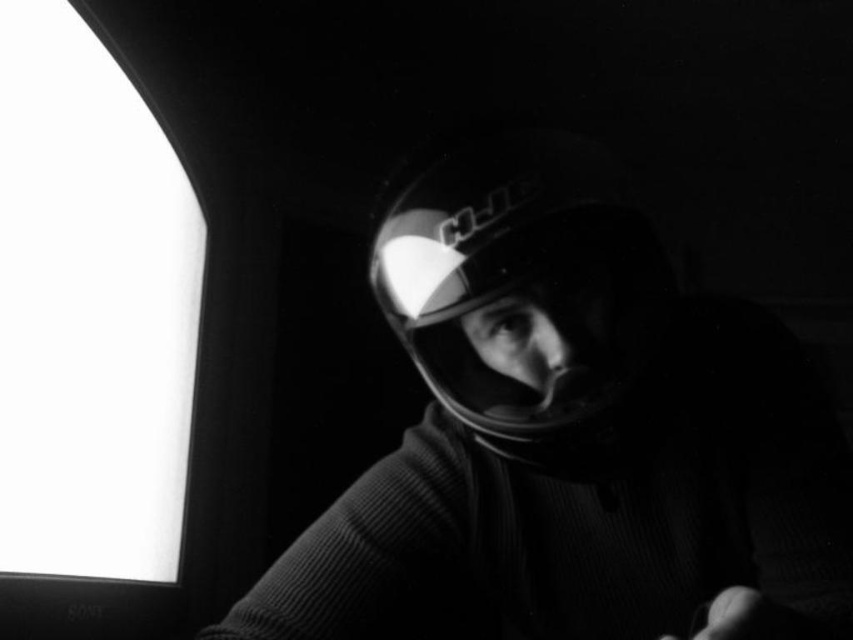
Question: Which of the following is the closest to the observer?

Choices:
 (A) matte black helmet at center
 (B) glossy plastic helmet at center
 (C) white glossy computer monitor at left

Answer: (A)

Question: Does matte black helmet at center have a lesser width compared to glossy plastic helmet at center?

Choices:
 (A) no
 (B) yes

Answer: (A)

Question: Which point appears closest to the camera in this image?

Choices:
 (A) click(83, 320)
 (B) click(503, 352)

Answer: (B)

Question: From the image, what is the correct spatial relationship of matte black helmet at center in relation to glossy plastic helmet at center?

Choices:
 (A) above
 (B) below

Answer: (B)

Question: Is matte black helmet at center smaller than white glossy computer monitor at left?

Choices:
 (A) no
 (B) yes

Answer: (A)

Question: Which of the following is the closest to the observer?

Choices:
 (A) (549, 355)
 (B) (78, 259)

Answer: (A)